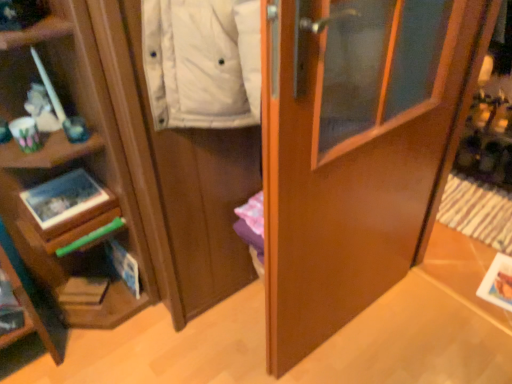
Where is `unoccupied area in front of matte cardboard magazine at lower left`? unoccupied area in front of matte cardboard magazine at lower left is located at coordinates (74, 337).